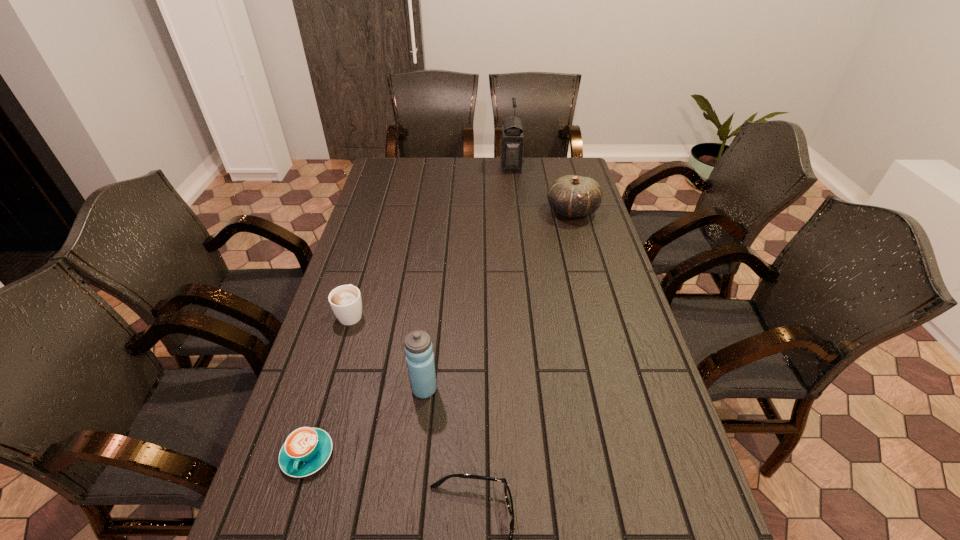
Find the location of a particular element. The image size is (960, 540). object present at the right edge is located at coordinates (573, 196).

Find the location of a particular element. This screenshot has width=960, height=540. vacant space at the far edge of the desktop is located at coordinates (480, 181).

Image resolution: width=960 pixels, height=540 pixels. Identify the location of vacant space at the left edge of the desktop. 265,496.

I want to click on free space at the right edge, so click(600, 293).

The image size is (960, 540). In the image, there is a desktop. What are the coordinates of `vacant space at the far right corner` in the screenshot? It's located at (552, 166).

You are a GUI agent. You are given a task and a screenshot of the screen. Output one action in this format:
    pyautogui.click(x=<x>, y=<y>)
    Task: Click on the free space between the third object from left to right and the fourth shortest object
    The height and width of the screenshot is (540, 960).
    Given the screenshot: What is the action you would take?
    pyautogui.click(x=498, y=300)

Where is `vacant space that is in between the tallest object and the shorter cappuccino`? vacant space that is in between the tallest object and the shorter cappuccino is located at coordinates (409, 311).

Where is `empty space between the third object from left to right and the lantern`? The image size is (960, 540). empty space between the third object from left to right and the lantern is located at coordinates (468, 278).

Where is `free space between the fourth object from right to left and the shorter cappuccino`? This screenshot has width=960, height=540. free space between the fourth object from right to left and the shorter cappuccino is located at coordinates (366, 422).

At what (x,y) coordinates should I click in order to perform the action: click on free spot between the farthest object and the rightmost object. Please return your answer as a coordinate pair (x, y). This screenshot has height=540, width=960. Looking at the image, I should click on (541, 189).